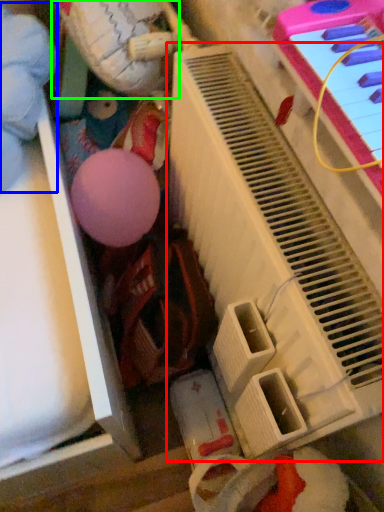
Question: Based on their relative distances, which object is nearer to piano (highlighted by a red box)? Choose from toy (highlighted by a blue box) and toy (highlighted by a green box).

Choices:
 (A) toy
 (B) toy

Answer: (B)